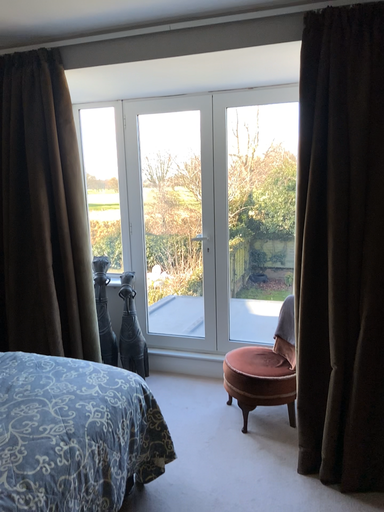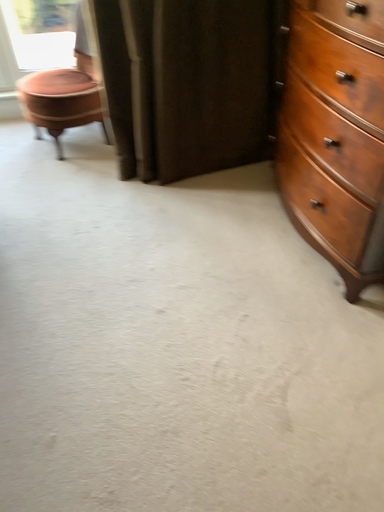
Question: Which way did the camera rotate in the video?

Choices:
 (A) rotated left
 (B) rotated right

Answer: (B)